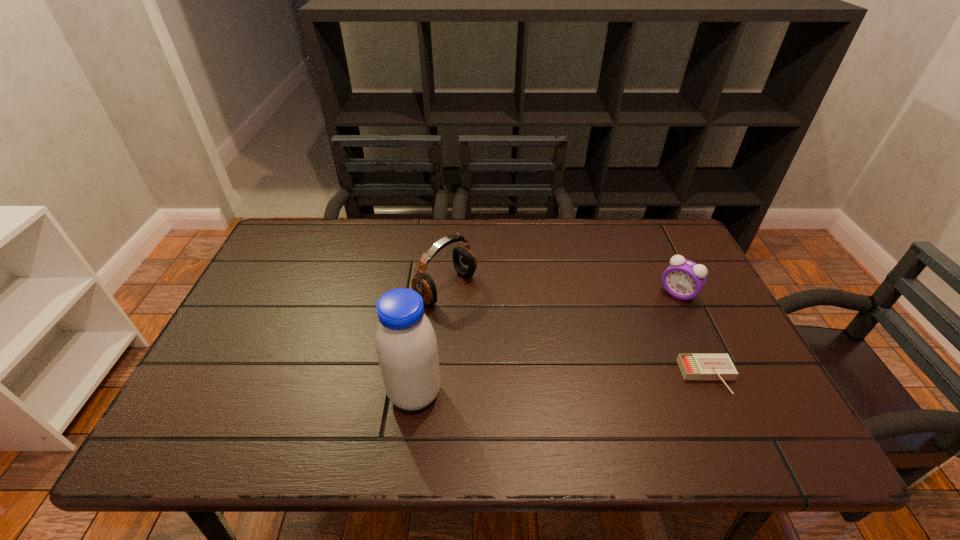
Locate an element on the screen. Image resolution: width=960 pixels, height=540 pixels. vacant position located on the face of the second shortest object is located at coordinates (636, 345).

This screenshot has height=540, width=960. I want to click on soya milk present at the near edge, so click(x=406, y=345).

Where is `matchbox located at the near edge`? The width and height of the screenshot is (960, 540). matchbox located at the near edge is located at coordinates (692, 366).

Identify the location of matchbox present at the right edge. (692, 366).

The image size is (960, 540). In order to click on alarm clock that is at the right edge in this screenshot , I will do `click(683, 279)`.

The height and width of the screenshot is (540, 960). In order to click on object that is at the near right corner in this screenshot , I will do `click(692, 366)`.

Where is `vacant space at the far edge of the desktop`? The width and height of the screenshot is (960, 540). vacant space at the far edge of the desktop is located at coordinates (491, 242).

Locate an element on the screen. The image size is (960, 540). blank space at the near edge of the desktop is located at coordinates (263, 399).

In the image, there is a desktop. Find the location of `vacant space at the left edge`. vacant space at the left edge is located at coordinates (276, 289).

In the image, there is a desktop. Where is `vacant space at the right edge`? The width and height of the screenshot is (960, 540). vacant space at the right edge is located at coordinates (699, 303).